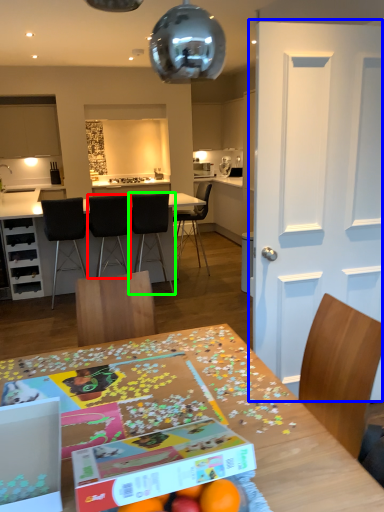
Question: Which object is the farthest from chair (highlighted by a red box)? Choose among these: door (highlighted by a blue box) or chair (highlighted by a green box).

Choices:
 (A) door
 (B) chair

Answer: (A)